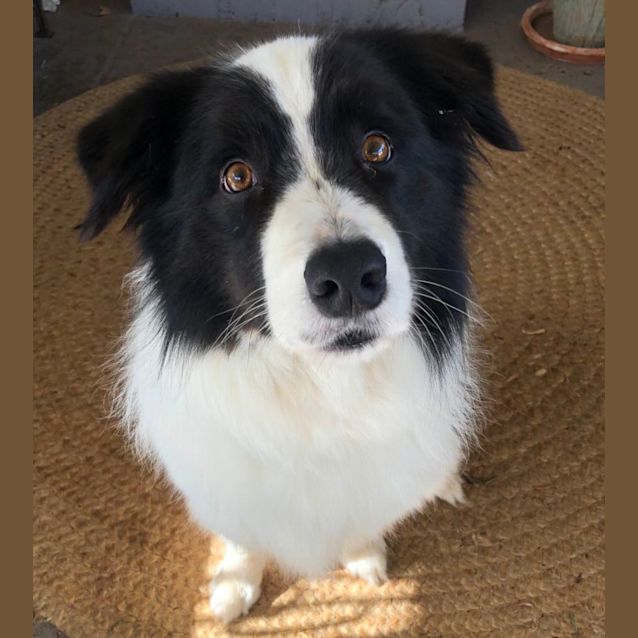
Where is `round rug`? This screenshot has width=638, height=638. round rug is located at coordinates (527, 572).